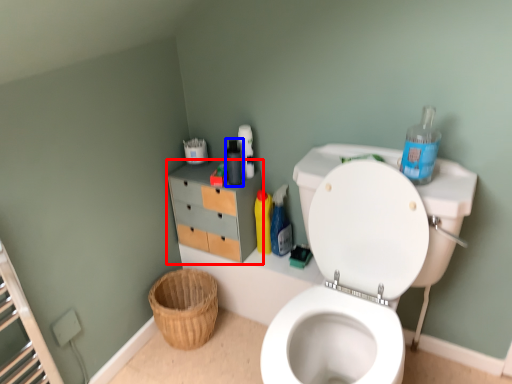
Question: Among these objects, which one is nearest to the camera, file cabinet (highlighted by a red box) or bottle (highlighted by a blue box)?

Choices:
 (A) file cabinet
 (B) bottle

Answer: (B)